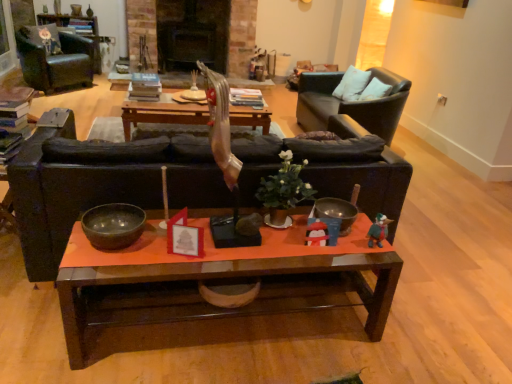
Question: From the image's perspective, relative to black leather chair at upper right, acting as the first chair starting from the right, is shiny dark wood bowl at center, which ranks as the 1th bowl in front-to-back order, above or below?

Choices:
 (A) above
 (B) below

Answer: (B)

Question: From a real-world perspective, is shiny dark wood bowl at center, which ranks as the 1th bowl in front-to-back order, positioned above or below black leather chair at upper right, which is the second chair from left to right?

Choices:
 (A) below
 (B) above

Answer: (B)

Question: Which object is positioned farthest from the matte black couch at center?

Choices:
 (A) black leather chair at upper right, which is the second chair from left to right
 (B) velvet floral pillow at upper left, the 1th pillow viewed from the back
 (C) metallic silver bowl at center, which is counted as the first bowl, starting from the back
 (D) green matte plant at center
 (E) white soft pillow at upper right, the 2th pillow viewed from the left

Answer: (B)

Question: Estimate the real-world distances between objects in this image. Which object is closer to the metallic silver bowl at center, arranged as the 2th bowl when viewed from the front?

Choices:
 (A) white soft pillow at upper right, placed as the first pillow when sorted from front to back
 (B) green matte plant at center
 (C) velvet floral pillow at upper left, the first pillow positioned from the top
 (D) shiny dark wood bowl at center, which ranks as the 1th bowl in front-to-back order
 (E) matte black couch at center

Answer: (B)